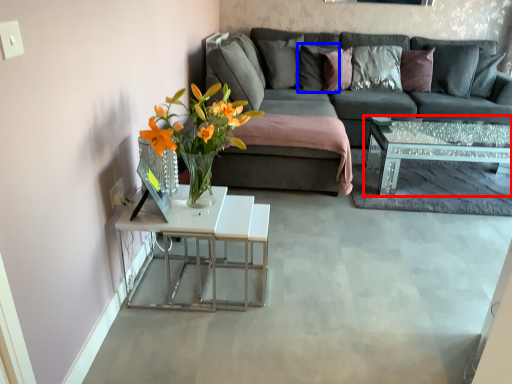
Question: Which object appears closest to the camera in this image, coffee table (highlighted by a red box) or pillow (highlighted by a blue box)?

Choices:
 (A) coffee table
 (B) pillow

Answer: (A)